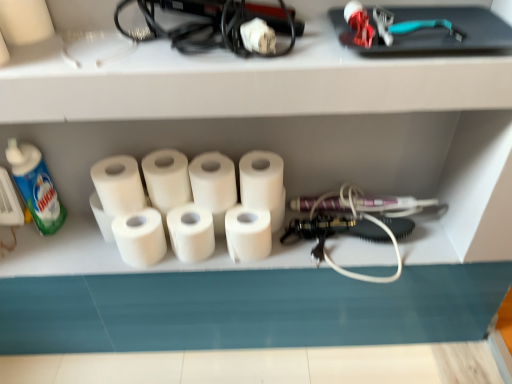
What do you see at coordinates (140, 237) in the screenshot? The height and width of the screenshot is (384, 512). I see `white matte toilet paper at center, the fifth toilet paper positioned from the right` at bounding box center [140, 237].

Based on the photo, what is the approximate width of white matte toilet paper at center, marked as the first toilet paper in a left-to-right arrangement?

→ 4.97 inches.

The height and width of the screenshot is (384, 512). I want to click on white matte toilet paper at center, marked as the first toilet paper in a left-to-right arrangement, so click(x=118, y=185).

What do you see at coordinates (191, 232) in the screenshot?
I see `white matte paper towel at center` at bounding box center [191, 232].

Identify the location of white matte paper towel at center. (191, 232).

What do you see at coordinates (213, 182) in the screenshot? The width and height of the screenshot is (512, 384). I see `white matte toilet paper at center, which ranks as the 3th toilet paper in right-to-left order` at bounding box center [213, 182].

This screenshot has height=384, width=512. Identify the location of white matte toilet paper at center, acting as the second toilet paper starting from the left. (140, 237).

Is white matte toilet paper at center, which ranks as the 3th toilet paper in right-to-left order, positioned with its back to white matte toilet paper at center, acting as the second toilet paper starting from the left?

That's not correct — white matte toilet paper at center, which ranks as the 3th toilet paper in right-to-left order, is not looking away from white matte toilet paper at center, acting as the second toilet paper starting from the left.

Is point (210, 188) closer or farther from the camera than point (114, 219)?

Clearly, point (210, 188) is closer to the camera than point (114, 219).

From a real-world perspective, is white matte toilet paper at center, which is the 4th toilet paper in left-to-right order, physically located above or below white matte toilet paper at center, acting as the second toilet paper starting from the left?

From a real-world perspective, white matte toilet paper at center, which is the 4th toilet paper in left-to-right order, is physically above white matte toilet paper at center, acting as the second toilet paper starting from the left.

Relative to white matte toilet paper at center, the fifth toilet paper positioned from the right, is white matte toilet paper at center, which ranks as the 3th toilet paper in right-to-left order, in front or behind?

white matte toilet paper at center, which ranks as the 3th toilet paper in right-to-left order, is positioned closer to the viewer than white matte toilet paper at center, the fifth toilet paper positioned from the right.

Which object is more forward, white matte toilet paper at center, the 2th toilet paper viewed from the right, or white matte toilet paper at center, which is the 4th toilet paper in left-to-right order?

white matte toilet paper at center, which is the 4th toilet paper in left-to-right order, is more forward.

Does white matte toilet paper at center, the 2th toilet paper viewed from the right, have a greater height compared to white matte toilet paper at center, which ranks as the 3th toilet paper in right-to-left order?

In fact, white matte toilet paper at center, the 2th toilet paper viewed from the right, may be shorter than white matte toilet paper at center, which ranks as the 3th toilet paper in right-to-left order.

How much distance is there between white matte toilet paper at center, marked as the 5th toilet paper in a left-to-right arrangement, and white matte toilet paper at center, which ranks as the 3th toilet paper in right-to-left order?

white matte toilet paper at center, marked as the 5th toilet paper in a left-to-right arrangement, and white matte toilet paper at center, which ranks as the 3th toilet paper in right-to-left order, are 3.10 inches apart.

Is white matte toilet paper at center, the 2th toilet paper viewed from the right, placed right next to white matte toilet paper at center, which ranks as the 3th toilet paper in right-to-left order?

Absolutely, white matte toilet paper at center, the 2th toilet paper viewed from the right, is next to and touching white matte toilet paper at center, which ranks as the 3th toilet paper in right-to-left order.

Between white matte toilet paper at center, marked as the first toilet paper in a left-to-right arrangement, and white matte toilet paper at center, which appears as the fourth toilet paper when viewed from the right, which one has larger size?

Bigger between the two is white matte toilet paper at center, marked as the first toilet paper in a left-to-right arrangement.

From a real-world perspective, is white matte toilet paper at center, the sixth toilet paper in the right-to-left sequence, on white matte toilet paper at center, which is counted as the third toilet paper, starting from the left?

Yes, from a real-world perspective, white matte toilet paper at center, the sixth toilet paper in the right-to-left sequence, is on top of white matte toilet paper at center, which is counted as the third toilet paper, starting from the left.

From the picture: Is white matte toilet paper at center, the sixth toilet paper in the right-to-left sequence, further to camera compared to white matte toilet paper at center, which is counted as the third toilet paper, starting from the left?

No.

Is white matte toilet paper at center, the sixth toilet paper in the right-to-left sequence, outside of white matte toilet paper at center, which appears as the fourth toilet paper when viewed from the right?

That's correct, white matte toilet paper at center, the sixth toilet paper in the right-to-left sequence, is outside of white matte toilet paper at center, which appears as the fourth toilet paper when viewed from the right.

Considering the sizes of objects white matte toilet paper at center, marked as the first toilet paper in a left-to-right arrangement, and white matte toilet paper at center, which is the 4th toilet paper in left-to-right order, in the image provided, who is wider, white matte toilet paper at center, marked as the first toilet paper in a left-to-right arrangement, or white matte toilet paper at center, which is the 4th toilet paper in left-to-right order,?

With larger width is white matte toilet paper at center, marked as the first toilet paper in a left-to-right arrangement.

How distant is white matte toilet paper at center, marked as the first toilet paper in a left-to-right arrangement, from white matte toilet paper at center, which is the 4th toilet paper in left-to-right order?

A distance of 6.46 inches exists between white matte toilet paper at center, marked as the first toilet paper in a left-to-right arrangement, and white matte toilet paper at center, which is the 4th toilet paper in left-to-right order.

Considering the relative sizes of white matte toilet paper at center, the sixth toilet paper in the right-to-left sequence, and white matte toilet paper at center, which ranks as the 3th toilet paper in right-to-left order, in the image provided, is white matte toilet paper at center, the sixth toilet paper in the right-to-left sequence, smaller than white matte toilet paper at center, which ranks as the 3th toilet paper in right-to-left order,?

Actually, white matte toilet paper at center, the sixth toilet paper in the right-to-left sequence, might be larger than white matte toilet paper at center, which ranks as the 3th toilet paper in right-to-left order.

Is white matte toilet paper at center, the sixth toilet paper in the right-to-left sequence, to the left of white matte toilet paper at center, which ranks as the 3th toilet paper in right-to-left order, from the viewer's perspective?

Yes, white matte toilet paper at center, the sixth toilet paper in the right-to-left sequence, is to the left of white matte toilet paper at center, which ranks as the 3th toilet paper in right-to-left order.

Is the depth of white matte toilet paper at center, the first toilet paper in the right-to-left sequence, less than that of white matte toilet paper at center, which appears as the fourth toilet paper when viewed from the right?

That is True.

Which object is positioned more to the right, white matte toilet paper at center, positioned as the sixth toilet paper in left-to-right order, or white matte toilet paper at center, which appears as the fourth toilet paper when viewed from the right?

Positioned to the right is white matte toilet paper at center, positioned as the sixth toilet paper in left-to-right order.

From a real-world perspective, is white matte toilet paper at center, positioned as the sixth toilet paper in left-to-right order, positioned under white matte toilet paper at center, which appears as the fourth toilet paper when viewed from the right, based on gravity?

Actually, white matte toilet paper at center, positioned as the sixth toilet paper in left-to-right order, is physically above white matte toilet paper at center, which appears as the fourth toilet paper when viewed from the right, in the real world.

Is white matte paper towel at center completely or partially outside of white matte toilet paper at center, marked as the first toilet paper in a left-to-right arrangement?

Absolutely, white matte paper towel at center is external to white matte toilet paper at center, marked as the first toilet paper in a left-to-right arrangement.

How far apart are white matte paper towel at center and white matte toilet paper at center, marked as the first toilet paper in a left-to-right arrangement?

white matte paper towel at center and white matte toilet paper at center, marked as the first toilet paper in a left-to-right arrangement, are 5.23 inches apart.

Is white matte paper towel at center further to camera compared to white matte toilet paper at center, the sixth toilet paper in the right-to-left sequence?

Yes, white matte paper towel at center is further from the viewer.

Identify the location of paper towel that appears on the left of white matte toilet paper at center, positioned as the sixth toilet paper in left-to-right order. (191, 232).

From a real-world perspective, is white matte paper towel at center on white matte toilet paper at center, the first toilet paper in the right-to-left sequence?

No, from a real-world perspective, white matte paper towel at center is not over white matte toilet paper at center, the first toilet paper in the right-to-left sequence

From the image's perspective, which one is positioned higher, white matte paper towel at center or white matte toilet paper at center, positioned as the sixth toilet paper in left-to-right order?

white matte toilet paper at center, positioned as the sixth toilet paper in left-to-right order.

At what (x,y) coordinates should I click in order to perform the action: click on the 2nd toilet paper counting from the left side of the white matte toilet paper at center, which is the 4th toilet paper in left-to-right order. Please return your answer as a coordinate pair (x, y). Looking at the image, I should click on (140, 237).

Image resolution: width=512 pixels, height=384 pixels. What are the coordinates of `the 2nd toilet paper behind the white matte toilet paper at center, which ranks as the 3th toilet paper in right-to-left order` in the screenshot? It's located at (248, 233).

Based on their spatial positions, is green matte bottle at left or white matte toilet paper at center, which ranks as the 3th toilet paper in right-to-left order, closer to white matte toilet paper at center, acting as the second toilet paper starting from the left?

white matte toilet paper at center, which ranks as the 3th toilet paper in right-to-left order, is closer to white matte toilet paper at center, acting as the second toilet paper starting from the left.

Looking at the image, which one is located closer to green matte bottle at left, white matte toilet paper at center, the fifth toilet paper positioned from the right, or white matte toilet paper at center, which ranks as the 3th toilet paper in right-to-left order?

white matte toilet paper at center, the fifth toilet paper positioned from the right, is positioned closer to the anchor green matte bottle at left.

Looking at the image, which one is located closer to white matte toilet paper at center, marked as the 5th toilet paper in a left-to-right arrangement, white matte paper towel at center or green matte bottle at left?

white matte paper towel at center is closer to white matte toilet paper at center, marked as the 5th toilet paper in a left-to-right arrangement.

Based on their spatial positions, is green matte bottle at left or white matte toilet paper at center, which ranks as the 3th toilet paper in right-to-left order, closer to white matte toilet paper at center, marked as the first toilet paper in a left-to-right arrangement?

Result: white matte toilet paper at center, which ranks as the 3th toilet paper in right-to-left order, is closer to white matte toilet paper at center, marked as the first toilet paper in a left-to-right arrangement.

Looking at the image, which one is located closer to white matte toilet paper at center, the sixth toilet paper in the right-to-left sequence, white matte toilet paper at center, which appears as the fourth toilet paper when viewed from the right, or white matte toilet paper at center, the 2th toilet paper viewed from the right?

white matte toilet paper at center, which appears as the fourth toilet paper when viewed from the right, lies closer to white matte toilet paper at center, the sixth toilet paper in the right-to-left sequence, than the other object.

Looking at this image, which object lies nearer to the anchor point green matte bottle at left, white matte paper towel at center or white matte toilet paper at center, which is counted as the third toilet paper, starting from the left?

Based on the image, white matte toilet paper at center, which is counted as the third toilet paper, starting from the left, appears to be nearer to green matte bottle at left.

Considering their positions, is white matte toilet paper at center, which is the 4th toilet paper in left-to-right order, positioned further to white matte toilet paper at center, the sixth toilet paper in the right-to-left sequence, than white matte toilet paper at center, the fifth toilet paper positioned from the right?

white matte toilet paper at center, which is the 4th toilet paper in left-to-right order, lies further to white matte toilet paper at center, the sixth toilet paper in the right-to-left sequence, than the other object.

Estimate the real-world distances between objects in this image. Which object is further from green matte bottle at left, white matte toilet paper at center, positioned as the sixth toilet paper in left-to-right order, or white matte toilet paper at center, acting as the second toilet paper starting from the left?

Based on the image, white matte toilet paper at center, positioned as the sixth toilet paper in left-to-right order, appears to be further to green matte bottle at left.

Where is `paper towel between green matte bottle at left and white matte toilet paper at center, positioned as the sixth toilet paper in left-to-right order, from left to right`? This screenshot has height=384, width=512. paper towel between green matte bottle at left and white matte toilet paper at center, positioned as the sixth toilet paper in left-to-right order, from left to right is located at coordinates (191, 232).

This screenshot has height=384, width=512. I want to click on paper towel between white matte toilet paper at center, marked as the first toilet paper in a left-to-right arrangement, and white matte toilet paper at center, which ranks as the 3th toilet paper in right-to-left order, from left to right, so point(191,232).

Where is `paper towel between green matte bottle at left and white matte toilet paper at center, marked as the 5th toilet paper in a left-to-right arrangement, in the horizontal direction`? The height and width of the screenshot is (384, 512). paper towel between green matte bottle at left and white matte toilet paper at center, marked as the 5th toilet paper in a left-to-right arrangement, in the horizontal direction is located at coordinates (191, 232).

Locate an element on the screen. paper towel located between white matte toilet paper at center, which appears as the fourth toilet paper when viewed from the right, and white matte toilet paper at center, marked as the 5th toilet paper in a left-to-right arrangement, in the left-right direction is located at coordinates (191, 232).